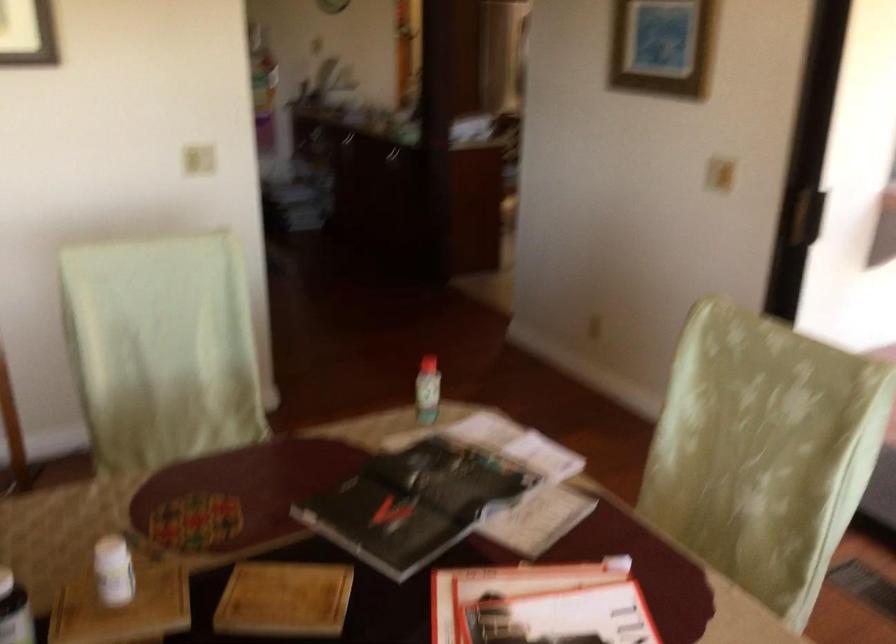
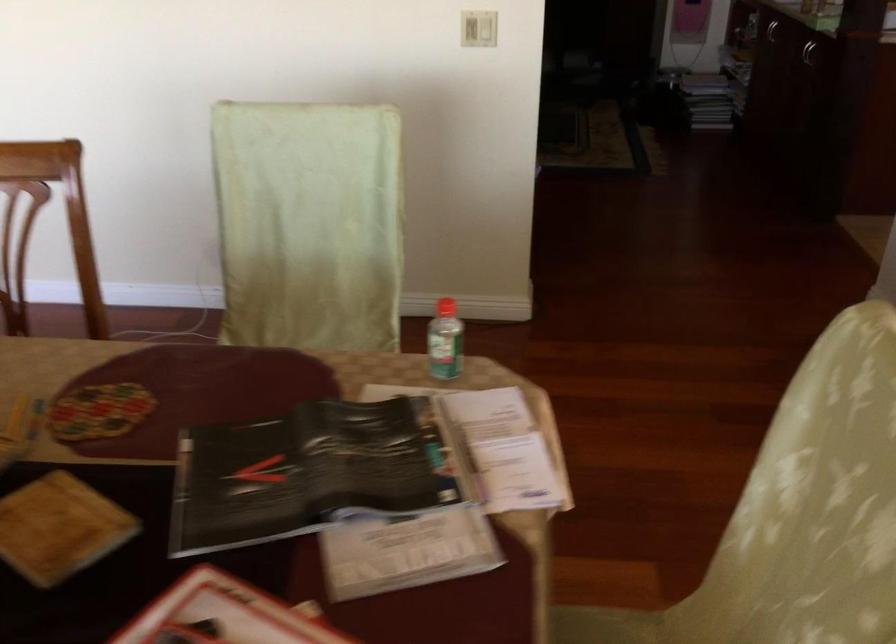
Question: How did the camera likely rotate?

Choices:
 (A) Left
 (B) Right
 (C) Up
 (D) Down

Answer: (A)